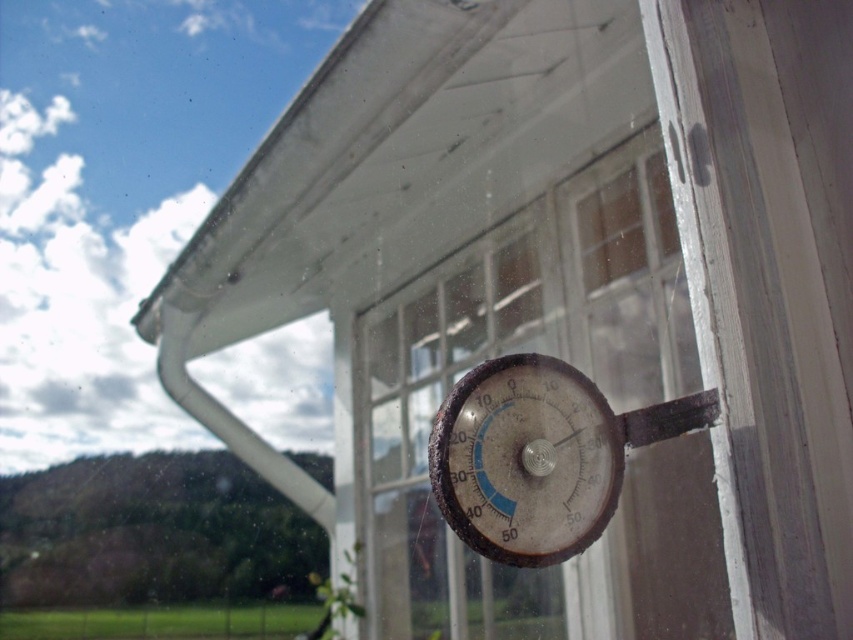
You are standing outside the building and looking at the vintage thermometer mounted on the wall. There is a point marked at coordinates [587,376]. Based on the image, where is this point located?

The point marked at coordinates [587,376] is on the transparent glass thermometer at center.

You are an architect designing a new building and want to place a new thermometer in the same location as the transparent glass thermometer at center. What are the coordinates of the position where you should place the new thermometer?

The coordinates for placing the new thermometer should be at point (587, 376), as that is where the transparent glass thermometer at center is located.